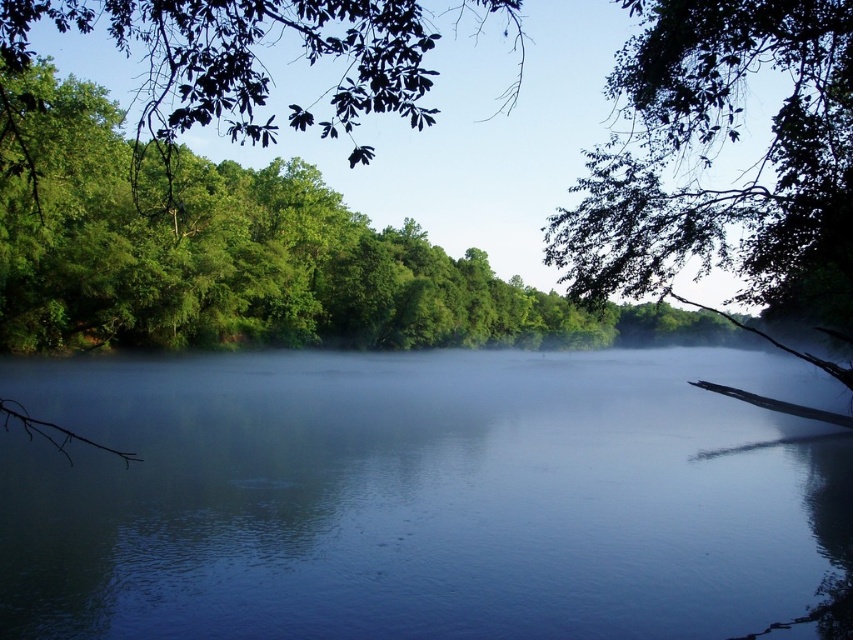
Does point (451, 518) come closer to viewer compared to point (0, 328)?

Yes, it is.

Between point (601, 472) and point (662, 330), which one is positioned in front?

Point (601, 472) is in front.

Is point (635, 564) more distant than point (84, 240)?

No, (635, 564) is in front of (84, 240).

Where is `blue reflective water at center`? The width and height of the screenshot is (853, 640). blue reflective water at center is located at coordinates (419, 497).

Is green leafy tree at upper left to the left of green leafy branch at upper right from the viewer's perspective?

Correct, you'll find green leafy tree at upper left to the left of green leafy branch at upper right.

Is green leafy tree at upper left taller than green leafy branch at upper right?

In fact, green leafy tree at upper left may be shorter than green leafy branch at upper right.

Who is more forward, (164, 182) or (563, 227)?

Point (563, 227)

The image size is (853, 640). In order to click on green leafy tree at upper left in this screenshot , I will do `click(228, 250)`.

Can you confirm if blue reflective water at center is smaller than green leafy branch at upper right?

Correct, blue reflective water at center occupies less space than green leafy branch at upper right.

Can you confirm if blue reflective water at center is positioned to the left of green leafy branch at upper right?

Indeed, blue reflective water at center is positioned on the left side of green leafy branch at upper right.

Does point (432, 570) come in front of point (801, 188)?

No, it is behind (801, 188).

This screenshot has width=853, height=640. Find the location of `blue reflective water at center`. blue reflective water at center is located at coordinates (419, 497).